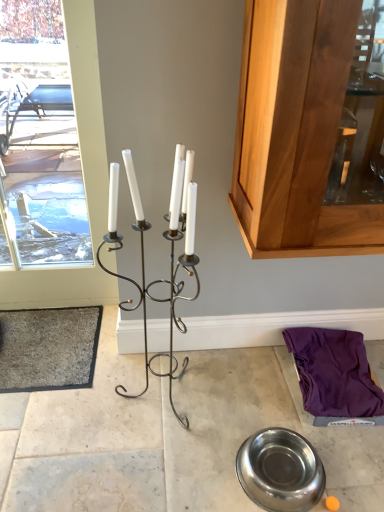
Identify the location of vacant region to the left of black wrought iron candle holder at center. (77, 407).